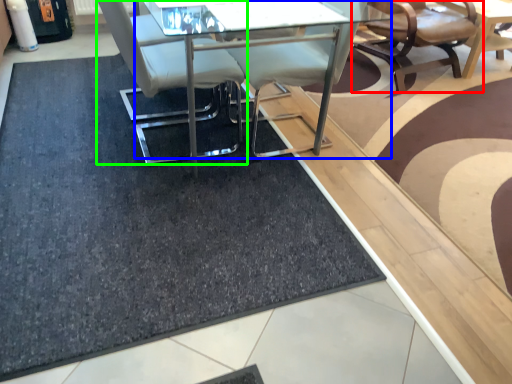
Question: Which object is the farthest from chair (highlighted by a red box)? Choose among these: table (highlighted by a blue box) or chair (highlighted by a green box).

Choices:
 (A) table
 (B) chair

Answer: (B)